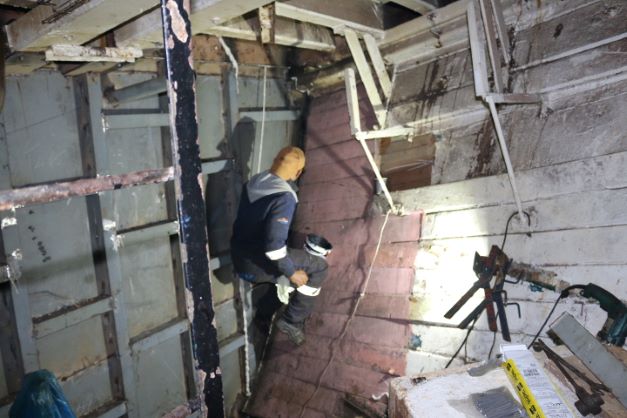
This screenshot has width=627, height=418. I want to click on wall, so pos(50,237).